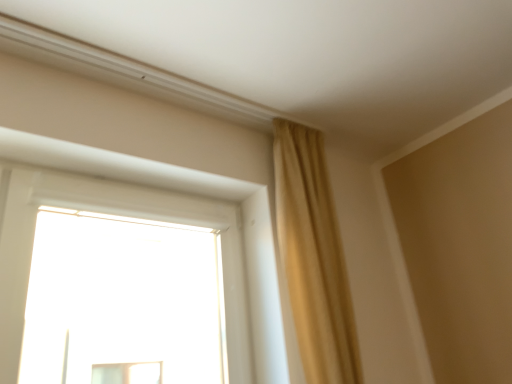
Describe the element at coordinates (313, 257) in the screenshot. This screenshot has width=512, height=384. I see `beige velvet curtain at upper right` at that location.

The image size is (512, 384). Find the location of `beige velvet curtain at upper right`. beige velvet curtain at upper right is located at coordinates (313, 257).

Where is `beige velvet curtain at upper right`? The image size is (512, 384). beige velvet curtain at upper right is located at coordinates (313, 257).